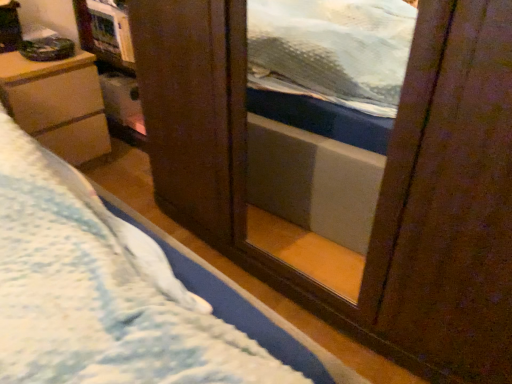
The image size is (512, 384). What do you see at coordinates (57, 104) in the screenshot? I see `wooden chest of drawers at left` at bounding box center [57, 104].

In order to click on wooden chest of drawers at left in this screenshot , I will do `click(57, 104)`.

The height and width of the screenshot is (384, 512). Identify the location of wooden chest of drawers at left. (57, 104).